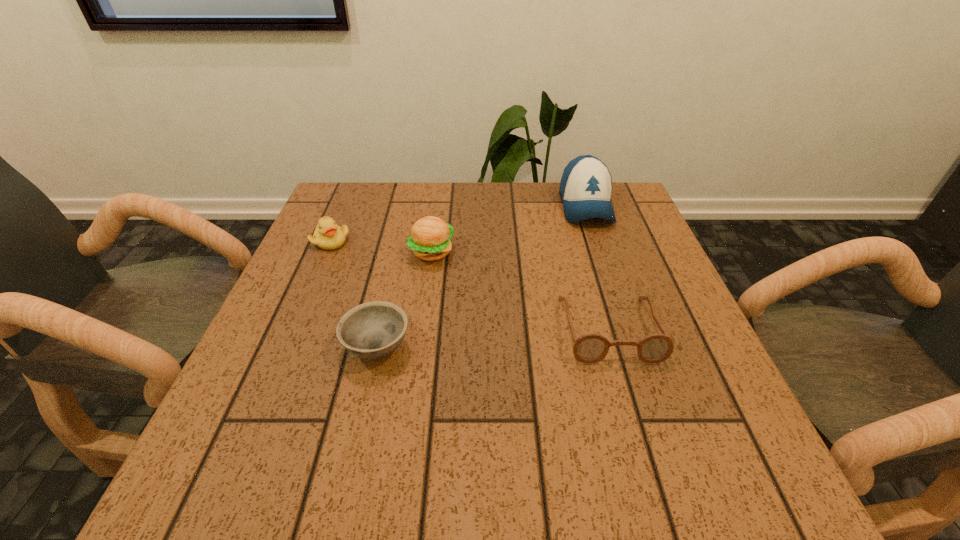
I want to click on empty space between the spectacles and the bowl, so click(493, 338).

The height and width of the screenshot is (540, 960). In order to click on empty location between the hamburger and the bowl in this screenshot , I will do `click(404, 300)`.

Locate an element on the screen. The width and height of the screenshot is (960, 540). free area in between the baseball cap and the second tallest object is located at coordinates [509, 228].

The image size is (960, 540). What are the coordinates of `empty space that is in between the spectacles and the bowl` in the screenshot? It's located at (493, 338).

You are a GUI agent. You are given a task and a screenshot of the screen. Output one action in this format:
    pyautogui.click(x=<x>, y=<y>)
    Task: Click on the empty space between the bowl and the leftmost object
    The height and width of the screenshot is (540, 960).
    Given the screenshot: What is the action you would take?
    pyautogui.click(x=354, y=294)

Locate an element on the screen. This screenshot has width=960, height=540. vacant point located between the bowl and the baseball cap is located at coordinates (481, 276).

Find the location of a particular element. The height and width of the screenshot is (540, 960). unoccupied area between the bowl and the duckling is located at coordinates (354, 294).

At what (x,y) coordinates should I click in order to perform the action: click on free spot between the duckling and the spectacles. Please return your answer as a coordinate pair (x, y). Looking at the image, I should click on (470, 285).

Find the location of a particular element. Image resolution: width=960 pixels, height=540 pixels. free area in between the tallest object and the bowl is located at coordinates (481, 276).

Locate an element on the screen. free area in between the hamburger and the duckling is located at coordinates (381, 246).